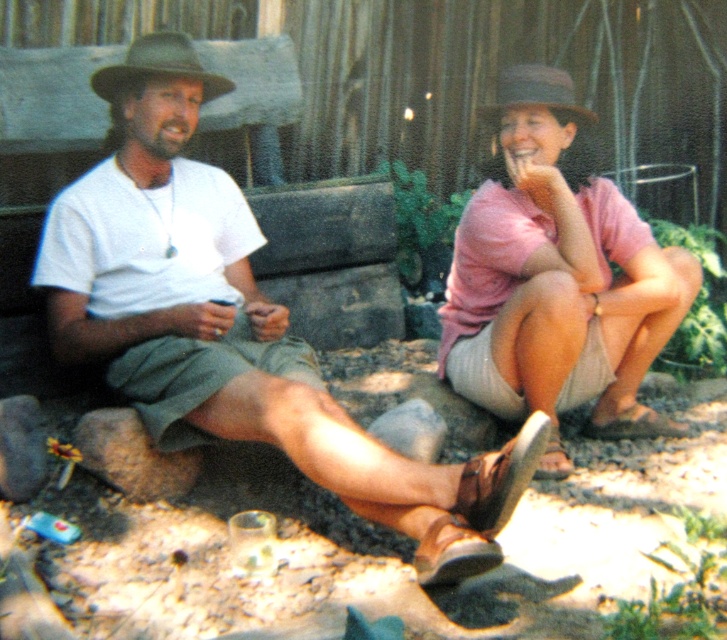
You are a photographer trying to capture a closeup shot of the matte khaki shorts at center and the brown felt cowboy hat at upper left. Your camera can focus on objects within a 15 inch range. Can you get both items in focus without adjusting your camera settings?

The matte khaki shorts at center is 14.91 inches away from the brown felt cowboy hat at upper left. Since the distance between them is within the 15 inch range, the camera can focus on both items without adjusting settings.

You are standing in the garden scene with two people. There is a point at coordinates (x=236, y=339). Which object from the scene does this point lie on?

The point at coordinates (x=236, y=339) lies on the matte khaki shorts at center.

You are a photographer trying to capture a clear shot of both the brown felt cowboy hat at upper left and the gray felt cowboy hat at upper right. However, you notice that one of them is partially blocking the view of the other. Which hat is blocking the other one?

The brown felt cowboy hat at upper left is in front of the gray felt cowboy hat at upper right, so it is blocking the view of the gray felt cowboy hat at upper right.